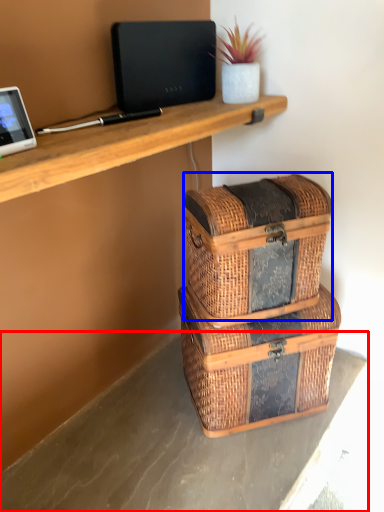
Question: Which point is further to the camera, concrete (highlighted by a red box) or storage box (highlighted by a blue box)?

Choices:
 (A) concrete
 (B) storage box

Answer: (B)